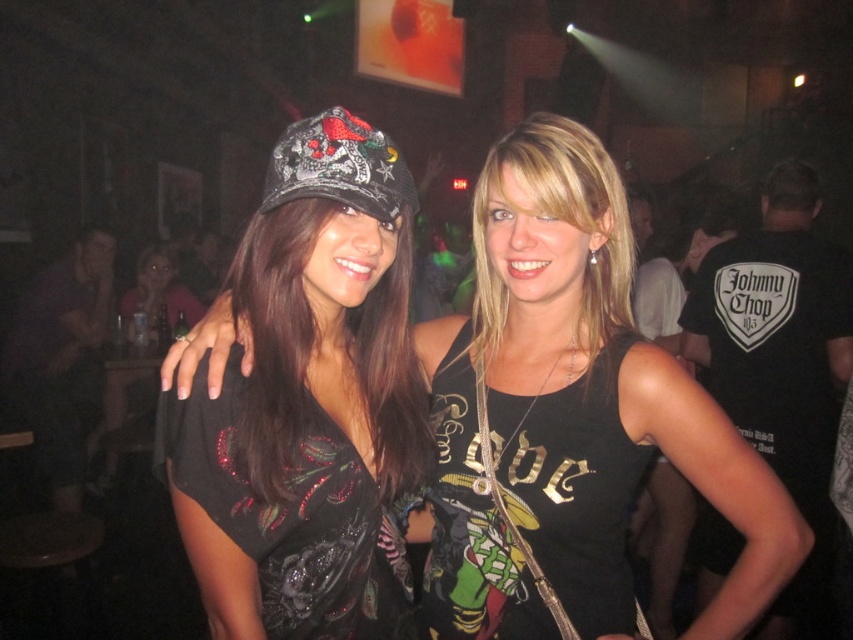
Question: Considering the relative positions of black matte tank top at center and black sequined dress at center in the image provided, where is black matte tank top at center located with respect to black sequined dress at center?

Choices:
 (A) right
 (B) left

Answer: (A)

Question: Can you confirm if shiny sequined top at center is smaller than black sequined dress at center?

Choices:
 (A) no
 (B) yes

Answer: (A)

Question: Which is nearer to the shiny sequined top at center?

Choices:
 (A) black matte tank top at center
 (B) black sequined dress at center

Answer: (A)

Question: Which point appears farthest from the camera in this image?

Choices:
 (A) (619, 541)
 (B) (221, 397)
 (C) (463, 518)

Answer: (A)

Question: Which of these objects is positioned closest to the black sequined dress at center?

Choices:
 (A) shiny sequined top at center
 (B) black matte tank top at center

Answer: (B)

Question: In this image, where is black matte tank top at center located relative to black sequined dress at center?

Choices:
 (A) above
 (B) below

Answer: (A)